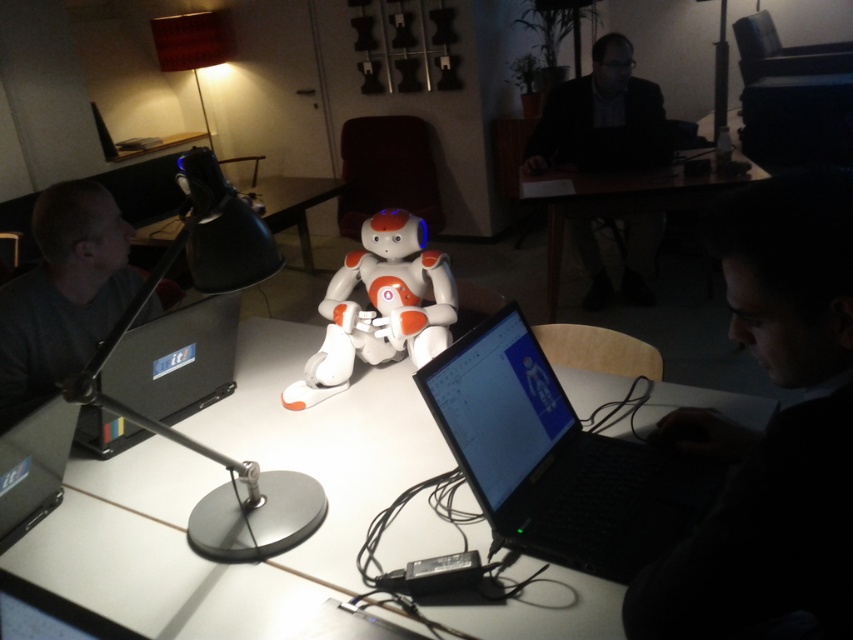
Can you confirm if white matte robot at center is wider than matte black laptop at left?

No, white matte robot at center is not wider than matte black laptop at left.

Is white matte robot at center closer to the viewer compared to matte black laptop at left?

No, it is not.

Locate an element on the screen. The width and height of the screenshot is (853, 640). white matte robot at center is located at coordinates (380, 307).

This screenshot has height=640, width=853. What do you see at coordinates (186, 435) in the screenshot?
I see `black metallic desk lamp at left` at bounding box center [186, 435].

Between black metallic desk lamp at left and matte black laptop at left, which one appears on the left side from the viewer's perspective?

From the viewer's perspective, matte black laptop at left appears more on the left side.

Image resolution: width=853 pixels, height=640 pixels. I want to click on black metallic desk lamp at left, so click(x=186, y=435).

Does black matte laptop at lower right have a larger size compared to wooden table at center?

Incorrect, black matte laptop at lower right is not larger than wooden table at center.

Does black matte laptop at lower right have a greater width compared to wooden table at center?

No.

What are the coordinates of `black matte laptop at lower right` in the screenshot? It's located at (770, 428).

Locate an element on the screen. This screenshot has height=640, width=853. black matte laptop at lower right is located at coordinates (770, 428).